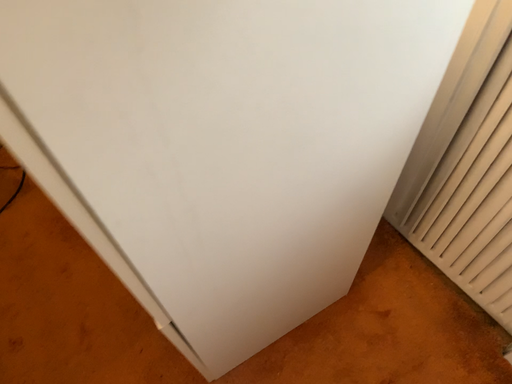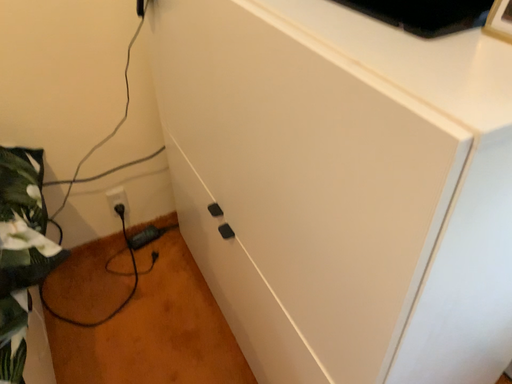
Question: How did the camera likely rotate when shooting the video?

Choices:
 (A) rotated upward
 (B) rotated downward

Answer: (A)